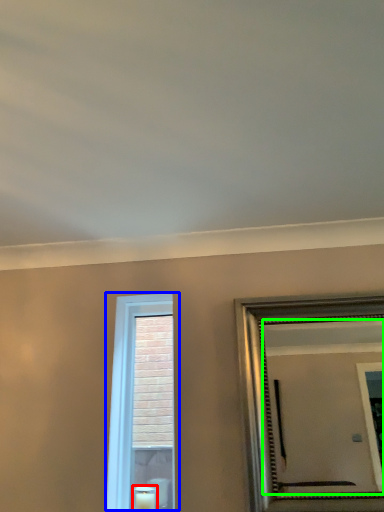
Question: Estimate the real-world distances between objects in this image. Which object is farther from candle (highlighted by a red box), window (highlighted by a blue box) or mirror (highlighted by a green box)?

Choices:
 (A) window
 (B) mirror

Answer: (B)